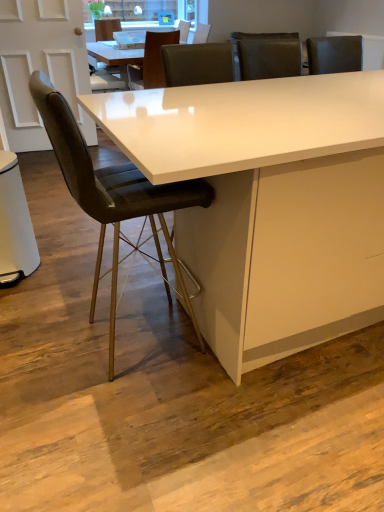
The image size is (384, 512). Find the location of `unoccupied space behind leather-like black chair at left, positioned as the first chair in bottom-to-top order`. unoccupied space behind leather-like black chair at left, positioned as the first chair in bottom-to-top order is located at coordinates click(x=127, y=285).